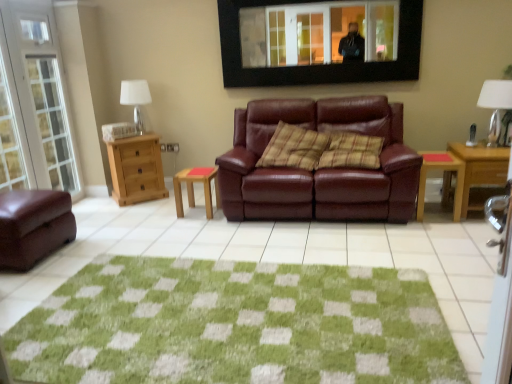
Question: Visually, is wooden dresser at left positioned to the left or to the right of white fabric lampshade at left, arranged as the 2th lamp when viewed from the front?

Choices:
 (A) left
 (B) right

Answer: (A)

Question: From the image's perspective, is wooden dresser at left above or below white fabric lampshade at left, arranged as the 1th lamp when viewed from the back?

Choices:
 (A) below
 (B) above

Answer: (A)

Question: Based on their relative distances, which object is farther from the white fabric lampshade at upper right, which appears as the 2th lamp when viewed from the back?

Choices:
 (A) wooden side table at right, the 2th table viewed from the left
 (B) green textured rug at center
 (C) matte brown leather ottoman at lower left, which appears as the first studio couch when viewed from the left
 (D) plaid fabric pillow at center
 (E) black framed mirror at upper center

Answer: (C)

Question: Estimate the real-world distances between objects in this image. Which object is farther from the wooden dresser at left?

Choices:
 (A) wooden stool at center, the second table from the right
 (B) wooden side table at right, which is counted as the 1th table, starting from the right
 (C) matte brown leather ottoman at lower left, arranged as the second studio couch when viewed from the right
 (D) green textured rug at center
 (E) white fabric lampshade at left, arranged as the 2th lamp when viewed from the front

Answer: (B)